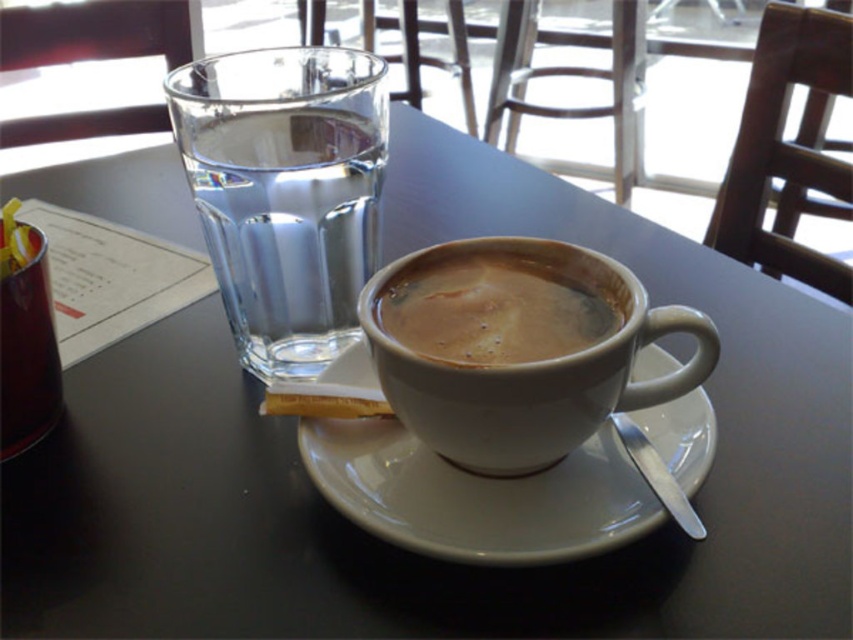
At what (x,y) coordinates should I click in order to perform the action: click on white ceramic saucer at center. Please return your answer as a coordinate pair (x, y). Looking at the image, I should click on (479, 497).

This screenshot has width=853, height=640. Describe the element at coordinates (479, 497) in the screenshot. I see `white ceramic saucer at center` at that location.

Which is behind, point (610, 490) or point (403, 260)?

The point (403, 260) is more distant.

At what (x,y) coordinates should I click in order to perform the action: click on white ceramic saucer at center. Please return your answer as a coordinate pair (x, y). Looking at the image, I should click on (479, 497).

Is point (685, 374) in front of point (12, 330)?

That is True.

Does point (462, 243) come in front of point (39, 372)?

Yes, it is.

Locate an element on the screen. The width and height of the screenshot is (853, 640). white matte mug at center is located at coordinates (531, 372).

Is white matte mug at center closer to the viewer compared to brown matte cup at center?

Yes, it is in front of brown matte cup at center.

Which is below, white matte mug at center or brown matte cup at center?

white matte mug at center is below.

Between point (573, 396) and point (573, 340), which one is positioned in front?

Point (573, 396) is more forward.

Find the location of a particular element. The height and width of the screenshot is (640, 853). white matte mug at center is located at coordinates point(531,372).